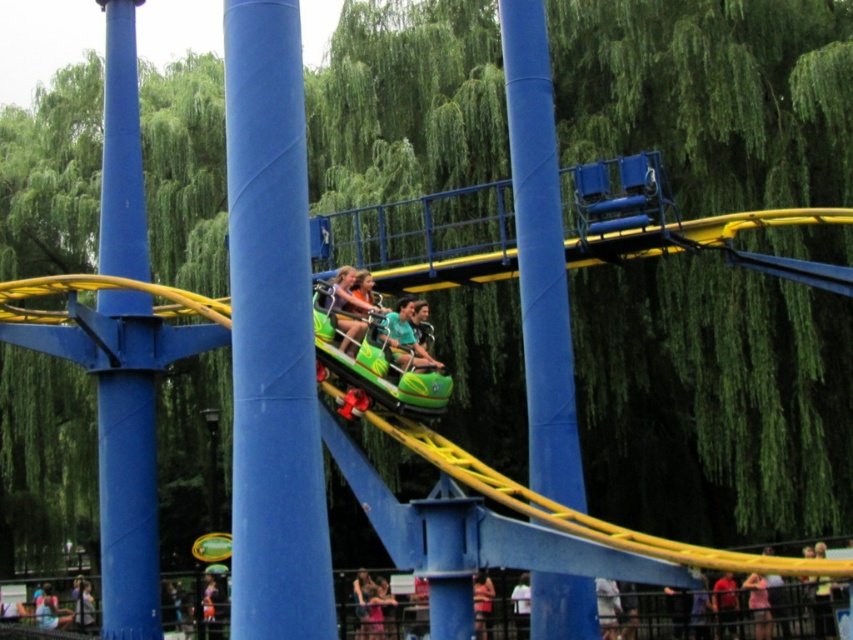
You are a safety inspector checking the amusement park ride. You notice the green matte roller coaster car at center and the light blue shirt at center. Based on their positions, is there a risk of collision between these two objects?

The green matte roller coaster car at center is positioned over the light blue shirt at center, so there is a risk of collision between these two objects.

You are a photographer standing at the base of the blue metallic pole at left and want to take a picture of the green plastic roller coaster car at center. Will the pole block your view of the car?

The blue metallic pole at left is above the green plastic roller coaster car at center, so the pole will not block your view of the car since it is positioned above it.

You are a park visitor who wants to take a photo of the blue glossy pole at center and the blue metallic pole at left. Which pole should you focus on first if you want to capture both in the same frame without moving your camera?

The blue glossy pole at center is smaller than the blue metallic pole at left, so you should focus on the blue metallic pole at left first since it is larger and will be more prominent in the frame.